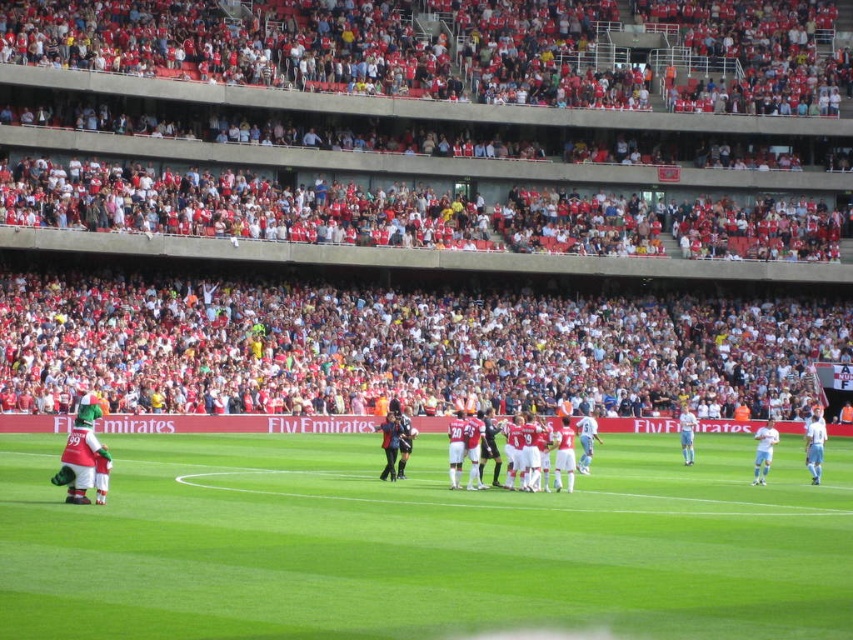
You are a photographer trying to capture a photo of the green grass field at center and the red fabric crowd at upper center. From your current position, which object is located to the right of the other?

The red fabric crowd at upper center is positioned on the right side of green grass field at center, so the red fabric crowd at upper center is to the right of the green grass field at center.